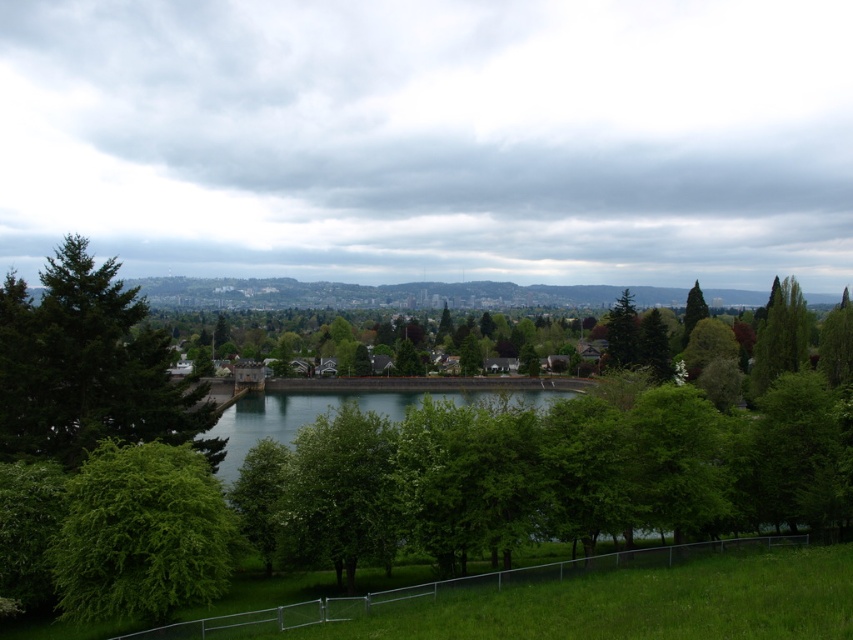
Question: Is green leafy tree at lower left below greenish-blue water at center?

Choices:
 (A) yes
 (B) no

Answer: (B)

Question: Among these objects, which one is farthest from the camera?

Choices:
 (A) green matte tree at upper right
 (B) green leafy tree at center
 (C) green matte tree at left
 (D) green leafy tree at lower left

Answer: (A)

Question: Does green matte tree at left have a lesser width compared to greenish-blue water at center?

Choices:
 (A) yes
 (B) no

Answer: (A)

Question: Does green matte tree at left appear over green leafy tree at lower left?

Choices:
 (A) no
 (B) yes

Answer: (B)

Question: Which of the following is the closest to the observer?

Choices:
 (A) green leafy tree at lower left
 (B) green matte tree at left
 (C) greenish-blue water at center
 (D) green leafy tree at center

Answer: (A)

Question: Which point is farther to the camera?

Choices:
 (A) green matte tree at left
 (B) green leafy tree at lower left
 (C) greenish-blue water at center
 (D) green leafy tree at center

Answer: (C)